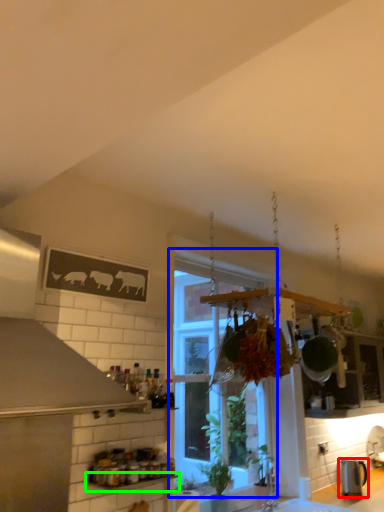
Question: Considering the real-world distances, which object is farthest from kitchen appliance (highlighted by a red box)? window (highlighted by a blue box) or window sill (highlighted by a green box)?

Choices:
 (A) window
 (B) window sill

Answer: (B)